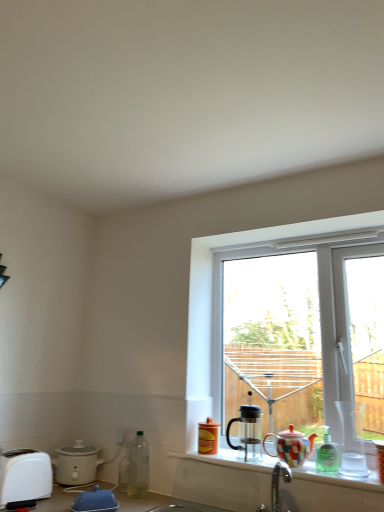
Identify the location of white glossy counter top at lower center. (336, 477).

The width and height of the screenshot is (384, 512). What are the coordinates of `green translucent bottle at lower right, marked as the first bottle in a right-to-left arrangement` in the screenshot? It's located at (326, 453).

Image resolution: width=384 pixels, height=512 pixels. Describe the element at coordinates (125, 435) in the screenshot. I see `white plastic electric outlet at lower left` at that location.

You are a GUI agent. You are given a task and a screenshot of the screen. Output one action in this format:
    pyautogui.click(x=<x>, y=<y>)
    Task: Click on the white plastic electric outlet at lower left
    The height and width of the screenshot is (512, 384).
    Given the screenshot: What is the action you would take?
    pyautogui.click(x=125, y=435)

In order to click on multicolored ceramic coffee cup at right, which is the first coffee cup in right-to-left order in this screenshot , I will do `click(380, 458)`.

Describe the element at coordinates (380, 458) in the screenshot. I see `multicolored ceramic coffee cup at right, which is the first coffee cup in right-to-left order` at that location.

The width and height of the screenshot is (384, 512). What do you see at coordinates (208, 437) in the screenshot?
I see `orange matte bottle at window, placed as the 2th bottle when sorted from left to right` at bounding box center [208, 437].

What do you see at coordinates (291, 446) in the screenshot? The width and height of the screenshot is (384, 512). I see `multicolored ceramic teapot at window` at bounding box center [291, 446].

The image size is (384, 512). What are the coordinates of `white glossy counter top at lower center` in the screenshot? It's located at (336, 477).

Is green translucent bottle at lower right, marked as the first bottle in a right-to-left arrangement, aimed at transparent glass coffee pot at window, marked as the first coffee cup in a left-to-right arrangement?

No.

There is a transparent glass coffee pot at window, the 3th coffee cup when ordered from right to left. In order to click on the 2nd bottle below it (from a real-world perspective) in this screenshot , I will do `click(326, 453)`.

Is green translucent bottle at lower right, marked as the first bottle in a right-to-left arrangement, behind transparent glass coffee pot at window, the 3th coffee cup when ordered from right to left?

No, the depth of green translucent bottle at lower right, marked as the first bottle in a right-to-left arrangement, is less than that of transparent glass coffee pot at window, the 3th coffee cup when ordered from right to left.

Which is less distant, (325, 463) or (254, 452)?

Point (325, 463) appears to be closer to the viewer than point (254, 452).

Between point (198, 448) and point (20, 475), which one is positioned in front?

The point (20, 475) is closer to the camera.

Is orange matte bottle at window, which appears as the second bottle when viewed from the right, far from white plastic toaster at lower left?

orange matte bottle at window, which appears as the second bottle when viewed from the right, is actually quite close to white plastic toaster at lower left.

Is orange matte bottle at window, which appears as the second bottle when viewed from the right, shorter than white plastic toaster at lower left?

Indeed, orange matte bottle at window, which appears as the second bottle when viewed from the right, has a lesser height compared to white plastic toaster at lower left.

In terms of width, does orange matte bottle at window, which appears as the second bottle when viewed from the right, look wider or thinner when compared to white plastic toaster at lower left?

In the image, orange matte bottle at window, which appears as the second bottle when viewed from the right, appears to be more narrow than white plastic toaster at lower left.

Which is in front, clear plastic bottle at lower left, which ranks as the third bottle in right-to-left order, or orange matte bottle at window, placed as the 2th bottle when sorted from left to right?

clear plastic bottle at lower left, which ranks as the third bottle in right-to-left order, is closer to the camera.

From a real-world perspective, starting from the clear plastic bottle at lower left, which ranks as the third bottle in right-to-left order, which bottle is the 2nd one vertically above it? Please provide its 2D coordinates.

[(208, 437)]

Would you say clear plastic bottle at lower left, the 1th bottle when ordered from left to right, is inside or outside orange matte bottle at window, which appears as the second bottle when viewed from the right?

The correct answer is: outside.

Considering the sizes of objects white plastic toaster at lower left and green translucent bottle at lower right, the third bottle viewed from the left, in the image provided, who is bigger, white plastic toaster at lower left or green translucent bottle at lower right, the third bottle viewed from the left,?

white plastic toaster at lower left is bigger.

What's the angular difference between white plastic toaster at lower left and green translucent bottle at lower right, the third bottle viewed from the left,'s facing directions?

The angular difference between white plastic toaster at lower left and green translucent bottle at lower right, the third bottle viewed from the left, is 88.8 degrees.

Choose the correct answer: Is white plastic toaster at lower left inside green translucent bottle at lower right, the third bottle viewed from the left, or outside it?

white plastic toaster at lower left is spatially situated outside green translucent bottle at lower right, the third bottle viewed from the left.

Which object is wider, white plastic toaster at lower left or green translucent bottle at lower right, the third bottle viewed from the left?

white plastic toaster at lower left.

Consider the image. Which point is more forward, (319,443) or (282,457)?

The point (319,443) is in front.

Looking at this image, from the image's perspective, is green translucent bottle at lower right, marked as the first bottle in a right-to-left arrangement, above or below multicolored ceramic teapot at window?

Based on their image positions, green translucent bottle at lower right, marked as the first bottle in a right-to-left arrangement, is located above multicolored ceramic teapot at window.

Is green translucent bottle at lower right, the third bottle viewed from the left, facing away from multicolored ceramic teapot at window?

No, green translucent bottle at lower right, the third bottle viewed from the left,'s orientation is not away from multicolored ceramic teapot at window.

How different are the orientations of green translucent bottle at lower right, marked as the first bottle in a right-to-left arrangement, and multicolored ceramic teapot at window in degrees?

They differ by 0.00436 degrees in their facing directions.

From the image's perspective, between multicolored ceramic coffee cup at right, which is the first coffee cup in right-to-left order, and white glossy counter top at lower center, who is located below?

white glossy counter top at lower center.

In the image, is multicolored ceramic coffee cup at right, which is the first coffee cup in right-to-left order, on the left side or the right side of white glossy counter top at lower center?

Based on their positions, multicolored ceramic coffee cup at right, which is the first coffee cup in right-to-left order, is located to the right of white glossy counter top at lower center.

Consider the image. Who is smaller, multicolored ceramic coffee cup at right, the 3th coffee cup positioned from the left, or white glossy counter top at lower center?

multicolored ceramic coffee cup at right, the 3th coffee cup positioned from the left, is smaller.

Is multicolored ceramic coffee cup at right, the 3th coffee cup positioned from the left, not near white glossy counter top at lower center?

multicolored ceramic coffee cup at right, the 3th coffee cup positioned from the left, is near white glossy counter top at lower center, not far away.

Would you say clear plastic bottle at lower left, which ranks as the third bottle in right-to-left order, is inside or outside green translucent bottle at lower right, marked as the first bottle in a right-to-left arrangement?

clear plastic bottle at lower left, which ranks as the third bottle in right-to-left order, cannot be found inside green translucent bottle at lower right, marked as the first bottle in a right-to-left arrangement.

Locate an element on the screen. bottle in front of the clear plastic bottle at lower left, which ranks as the third bottle in right-to-left order is located at coordinates (326, 453).

Which is in front, clear plastic bottle at lower left, the 1th bottle when ordered from left to right, or green translucent bottle at lower right, marked as the first bottle in a right-to-left arrangement?

green translucent bottle at lower right, marked as the first bottle in a right-to-left arrangement, is in front.

From the image's perspective, relative to green translucent bottle at lower right, the third bottle viewed from the left, is clear plastic bottle at lower left, which ranks as the third bottle in right-to-left order, above or below?

Clearly, from the image's perspective, clear plastic bottle at lower left, which ranks as the third bottle in right-to-left order, is below green translucent bottle at lower right, the third bottle viewed from the left.

Where is `the 1st coffee cup positioned above the green translucent bottle at lower right, marked as the first bottle in a right-to-left arrangement (from the image's perspective)`? This screenshot has height=512, width=384. the 1st coffee cup positioned above the green translucent bottle at lower right, marked as the first bottle in a right-to-left arrangement (from the image's perspective) is located at coordinates (248, 431).

In order to click on the 3rd bottle above the white plastic toaster at lower left (from a real-world perspective) in this screenshot , I will do `click(208, 437)`.

Estimate the real-world distances between objects in this image. Which object is further from transparent glass coffee pot at window, the 3th coffee cup when ordered from right to left, clear plastic bottle at lower left, the 1th bottle when ordered from left to right, or matte white slow cooker at lower left?

matte white slow cooker at lower left lies further to transparent glass coffee pot at window, the 3th coffee cup when ordered from right to left, than the other object.

Looking at the image, which one is located closer to white plastic toaster at lower left, orange matte bottle at window, placed as the 2th bottle when sorted from left to right, or clear plastic bottle at lower left, the 1th bottle when ordered from left to right?

clear plastic bottle at lower left, the 1th bottle when ordered from left to right.

Which object lies nearer to the anchor point white plastic toaster at lower left, translucent glass coffee cup at right, which is the 2th coffee cup from right to left, or clear plastic bottle at lower left, which ranks as the third bottle in right-to-left order?

→ clear plastic bottle at lower left, which ranks as the third bottle in right-to-left order, is positioned closer to the anchor white plastic toaster at lower left.

Looking at the image, which one is located further to white glossy counter top at lower center, clear plastic bottle at lower left, the 1th bottle when ordered from left to right, or transparent plastic window at center?

transparent plastic window at center is positioned further to the anchor white glossy counter top at lower center.

When comparing their distances from blue rubber duck at lower left, does white plastic electric outlet at lower left or clear plastic bottle at lower left, the 1th bottle when ordered from left to right, seem closer?

clear plastic bottle at lower left, the 1th bottle when ordered from left to right.

Considering their positions, is white plastic toaster at lower left positioned closer to matte white slow cooker at lower left than multicolored ceramic teapot at window?

Among the two, white plastic toaster at lower left is located nearer to matte white slow cooker at lower left.

Estimate the real-world distances between objects in this image. Which object is closer to blue rubber duck at lower left, white plastic electric outlet at lower left or matte white slow cooker at lower left?

matte white slow cooker at lower left is positioned closer to the anchor blue rubber duck at lower left.

In the scene shown: Estimate the real-world distances between objects in this image. Which object is closer to green translucent bottle at lower right, the third bottle viewed from the left, transparent plastic window at center or transparent glass coffee pot at window, marked as the first coffee cup in a left-to-right arrangement?

transparent glass coffee pot at window, marked as the first coffee cup in a left-to-right arrangement.

Where is `teapot between white plastic electric outlet at lower left and green translucent bottle at lower right, marked as the first bottle in a right-to-left arrangement`? This screenshot has height=512, width=384. teapot between white plastic electric outlet at lower left and green translucent bottle at lower right, marked as the first bottle in a right-to-left arrangement is located at coordinates (291, 446).

The width and height of the screenshot is (384, 512). In order to click on bottle between blue rubber duck at lower left and orange matte bottle at window, placed as the 2th bottle when sorted from left to right in this screenshot , I will do `click(138, 467)`.

The width and height of the screenshot is (384, 512). In order to click on counter top situated between white plastic toaster at lower left and multicolored ceramic teapot at window from left to right in this screenshot , I will do `click(336, 477)`.

Where is `window between orange matte bottle at window, which appears as the second bottle when viewed from the right, and green translucent bottle at lower right, the third bottle viewed from the left, in the horizontal direction`? window between orange matte bottle at window, which appears as the second bottle when viewed from the right, and green translucent bottle at lower right, the third bottle viewed from the left, in the horizontal direction is located at coordinates (215, 304).